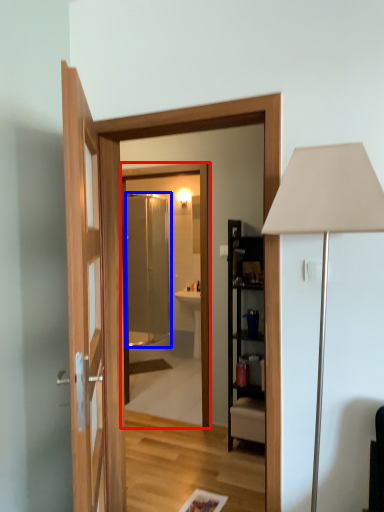
Question: Which object is further to the camera taking this photo, mirror (highlighted by a red box) or screen door (highlighted by a blue box)?

Choices:
 (A) mirror
 (B) screen door

Answer: (B)